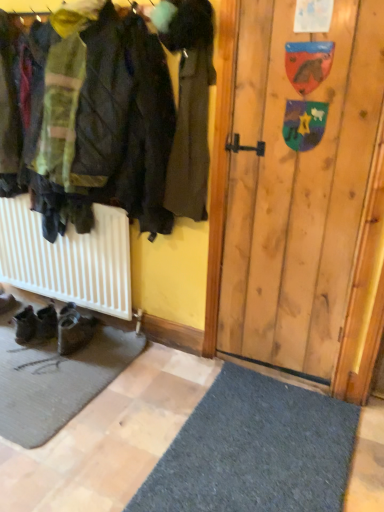
Question: Can you confirm if dark brown leather coat at center is taller than brown suede boots at lower left, the first footwear when ordered from left to right?

Choices:
 (A) yes
 (B) no

Answer: (A)

Question: Would you say brown suede boots at lower left, the first footwear when ordered from left to right, is part of dark brown leather coat at center's contents?

Choices:
 (A) no
 (B) yes

Answer: (A)

Question: Are dark brown leather coat at center and brown suede boots at lower left, the second footwear in the right-to-left sequence, far apart?

Choices:
 (A) yes
 (B) no

Answer: (A)

Question: Is dark brown leather coat at center at the right side of brown suede boots at lower left, the first footwear when ordered from left to right?

Choices:
 (A) no
 (B) yes

Answer: (B)

Question: From the image's perspective, is dark brown leather coat at center under brown suede boots at lower left, the second footwear in the right-to-left sequence?

Choices:
 (A) no
 (B) yes

Answer: (A)

Question: Would you say brown suede boots at lower left, the second footwear in the right-to-left sequence, is inside or outside dark brown leather coat at center?

Choices:
 (A) outside
 (B) inside

Answer: (A)

Question: From a real-world perspective, is brown suede boots at lower left, the first footwear when ordered from left to right, positioned above or below dark brown leather coat at center?

Choices:
 (A) above
 (B) below

Answer: (B)

Question: From the image's perspective, is brown suede boots at lower left, the first footwear when ordered from left to right, above or below dark brown leather coat at center?

Choices:
 (A) above
 (B) below

Answer: (B)

Question: Would you say brown suede boots at lower left, the second footwear in the right-to-left sequence, is to the left or to the right of dark brown leather coat at center in the picture?

Choices:
 (A) left
 (B) right

Answer: (A)

Question: Based on their positions, is dark brown leather coat at center located to the left or right of brown suede boots at lower left, the second footwear in the right-to-left sequence?

Choices:
 (A) left
 (B) right

Answer: (B)

Question: Considering their positions, is dark brown leather coat at center located in front of or behind brown suede boots at lower left, the second footwear in the right-to-left sequence?

Choices:
 (A) behind
 (B) front

Answer: (B)

Question: From a real-world perspective, is dark brown leather coat at center positioned above or below brown suede boots at lower left, the first footwear when ordered from left to right?

Choices:
 (A) below
 (B) above

Answer: (B)

Question: Would you say dark brown leather coat at center is inside or outside brown suede boots at lower left, the first footwear when ordered from left to right?

Choices:
 (A) inside
 (B) outside

Answer: (B)

Question: Is black leather shoes at lower left, the 2th footwear from the left, spatially inside dark brown leather coat at center, or outside of it?

Choices:
 (A) outside
 (B) inside

Answer: (A)

Question: Considering the positions of point (64, 308) and point (185, 16), is point (64, 308) closer or farther from the camera than point (185, 16)?

Choices:
 (A) closer
 (B) farther

Answer: (B)